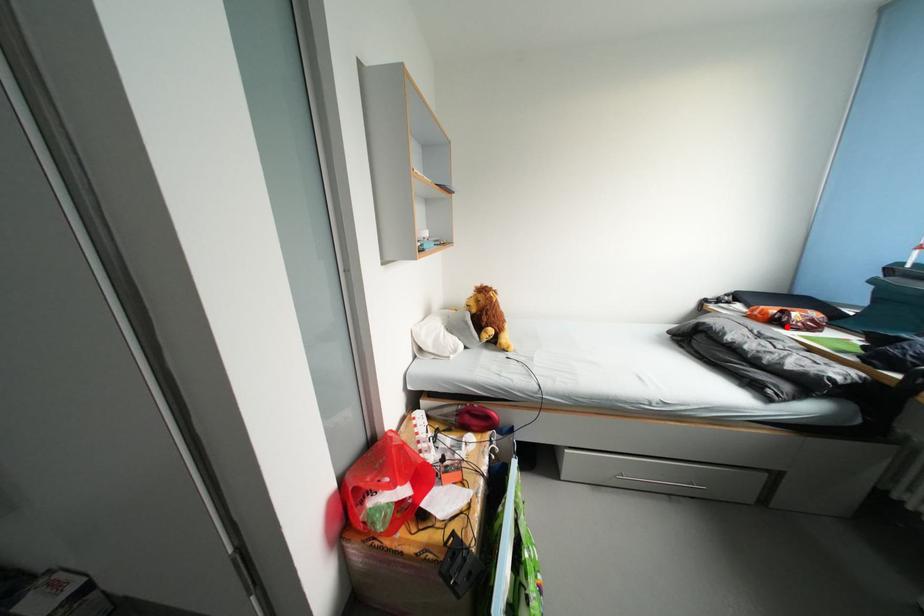
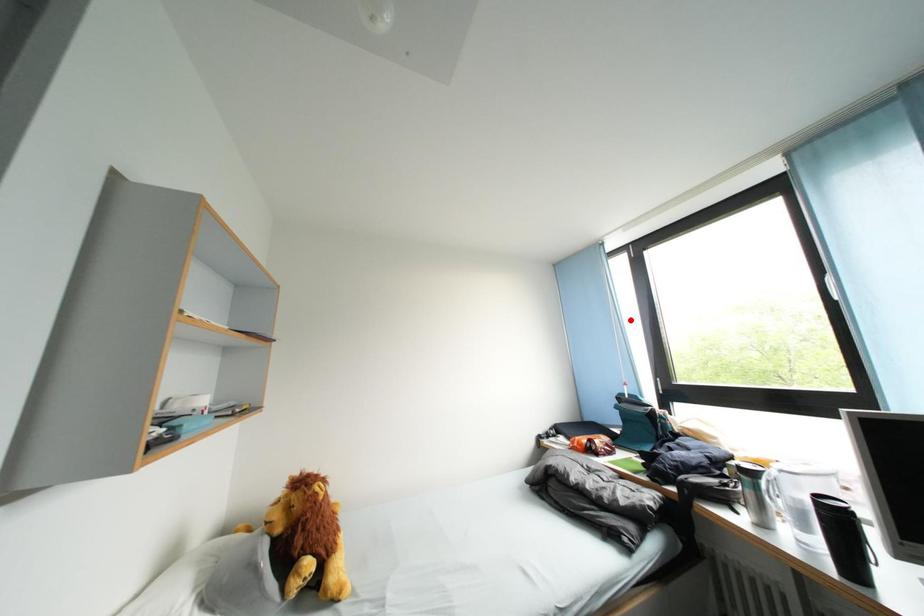
I am providing you with two images of the same scene from different viewpoints. A red point is marked on the first image and another point is marked on the second image. Are the points marked in image1 and image2 representing the same 3D position?

No